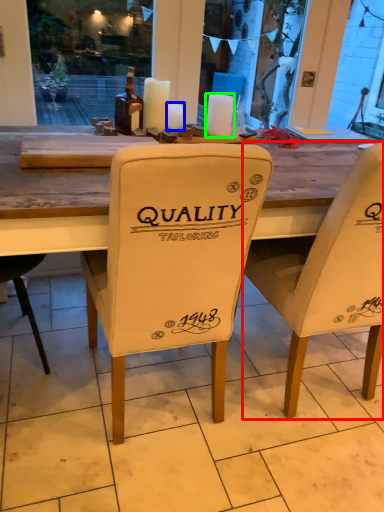
Question: Estimate the real-world distances between objects in this image. Which object is farther from chair (highlighted by a red box), candle (highlighted by a blue box) or candle (highlighted by a green box)?

Choices:
 (A) candle
 (B) candle

Answer: (A)